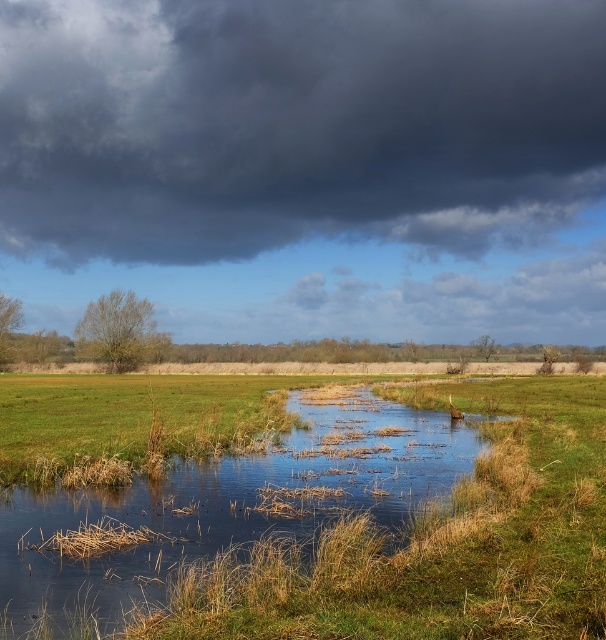
You are planning to set up a weather station to monitor cloud and water levels. The station requires a clear view of both the dark gray cloud at upper center and the green grassy stream at center. Which object will require a wider lens to capture in full frame?

The dark gray cloud at upper center is bigger than the green grassy stream at center, so a wider lens will be needed to capture the dark gray cloud at upper center in full frame.

You are an observer standing at the edge of the green grassy stream at center. Looking up, you notice the dark gray cloud at upper center. Which object appears higher in the sky?

The dark gray cloud at upper center appears higher in the sky than the green grassy stream at center because it is taller.

You are standing in the middle of the grassy field in the image and want to estimate how far the dark gray cloud at upper center is from you. Based on the scene, can you provide an approximate distance?

The dark gray cloud at upper center is approximately 143.99 meters away from the viewer.